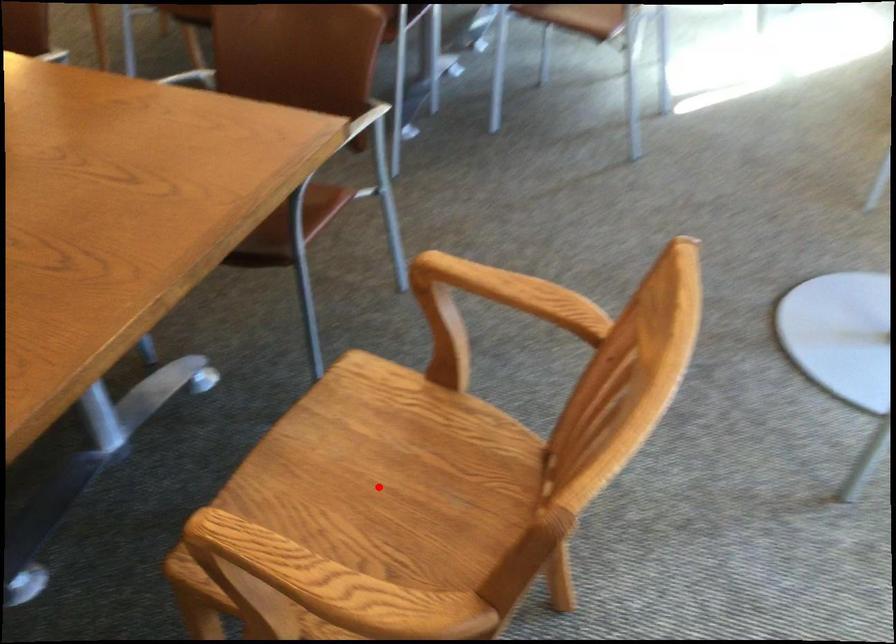
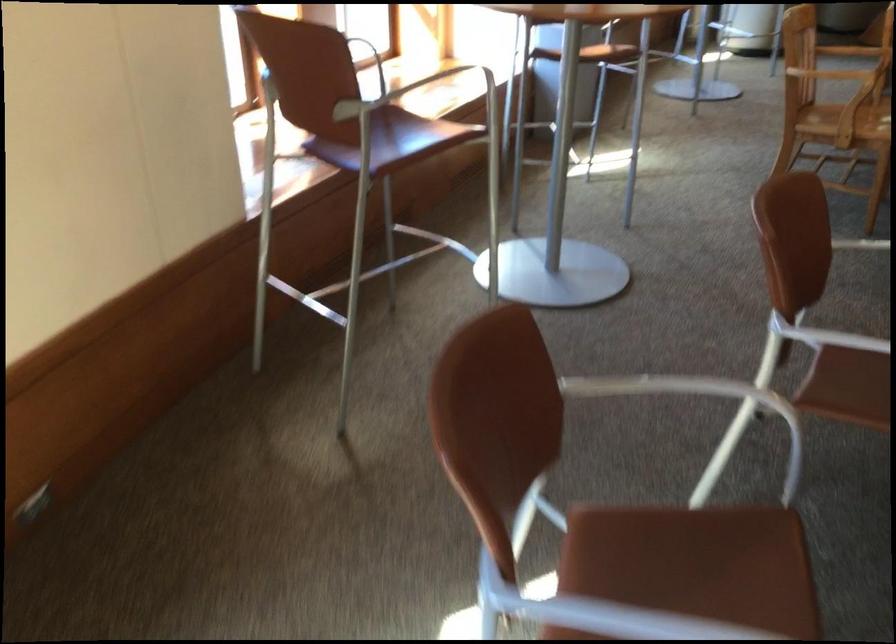
Question: I am providing you with two images of the same scene from different viewpoints. A red point is marked on the first image. Can you still see the location of the red point in image 2?

Choices:
 (A) Yes
 (B) No

Answer: (B)